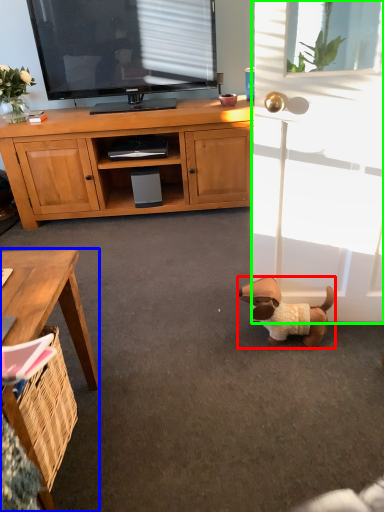
Question: Which object is the closest to the dog (highlighted by a red box)? Choose among these: desk (highlighted by a blue box) or screen door (highlighted by a green box).

Choices:
 (A) desk
 (B) screen door

Answer: (B)